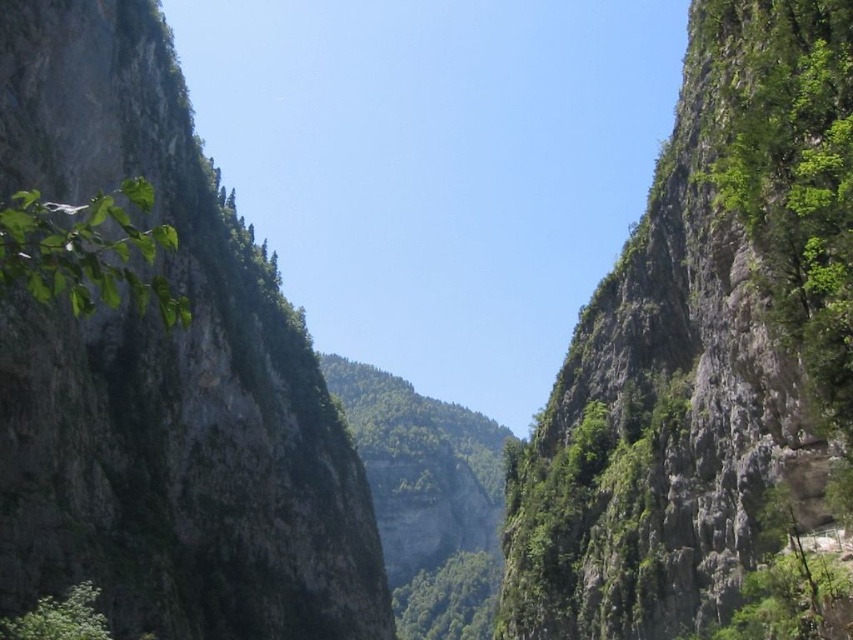
In the scene shown: You are a hiker planning to cross the canyon using a narrow path that runs between the green rocky cliff at center and the green rough rock at left. The path is exactly 39.34 meters wide. If your backpack has a width of 2 meters, will you be able to pass through the path without any issues?

The path between the green rocky cliff at center and the green rough rock at left is 39.34 meters wide, which is significantly wider than your backpack width of 2 meters. Therefore, you will be able to pass through the path without any issues.

You are a hiker planning to climb the green rocky cliff at center and the green rough rock at left. Based on their heights, which one would require less effort to ascend?

The green rocky cliff at center is shorter than the green rough rock at left, so it would require less effort to ascend the green rocky cliff at center.